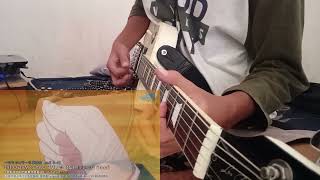
Locate an element on the screen. The image size is (320, 180). wall is located at coordinates (55, 20).